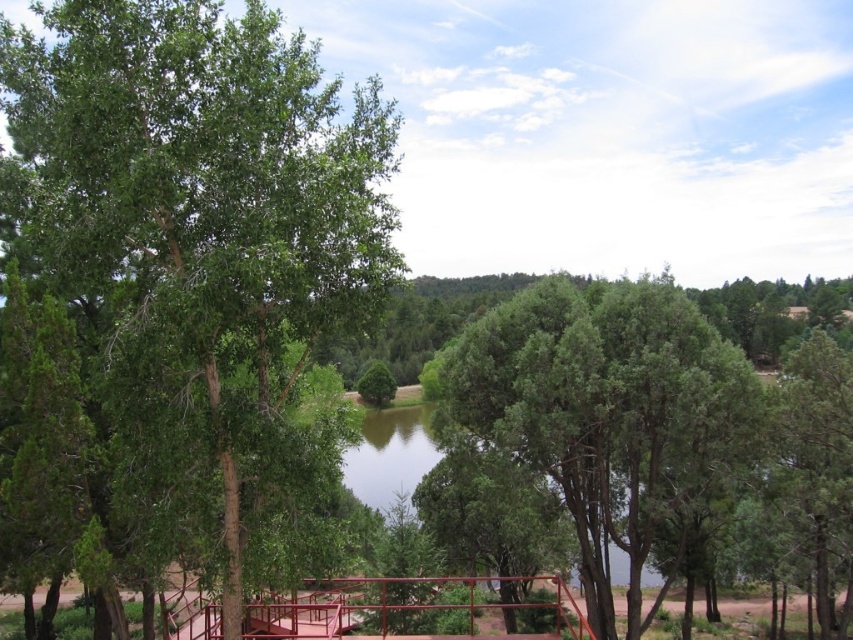
How distant is green leafy tree at left from green textured tree at center?

A distance of 13.93 meters exists between green leafy tree at left and green textured tree at center.

Can you confirm if green leafy tree at left is smaller than green textured tree at center?

Yes.

Is point (276, 292) positioned after point (712, 458)?

No, it is in front of (712, 458).

This screenshot has height=640, width=853. What are the coordinates of `green leafy tree at left` in the screenshot? It's located at (206, 227).